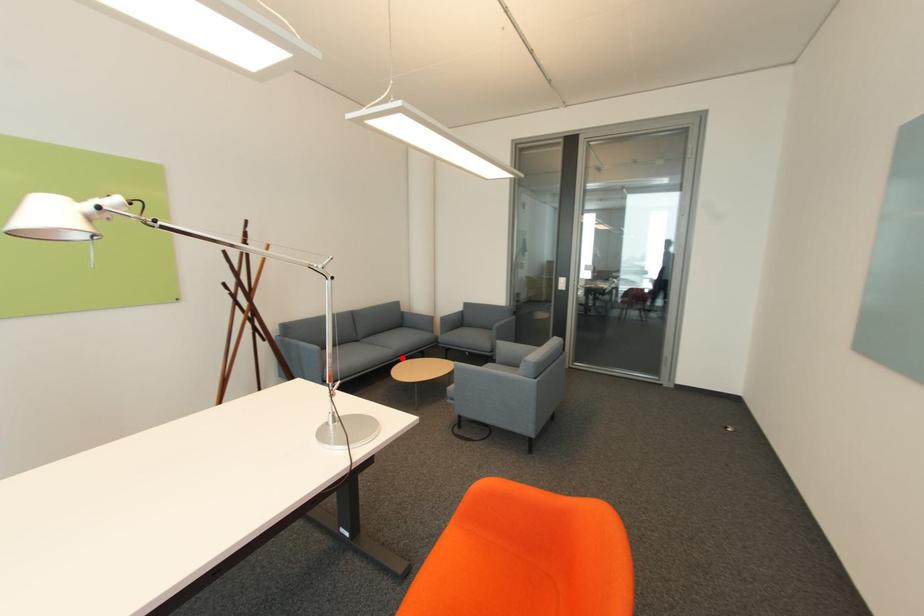
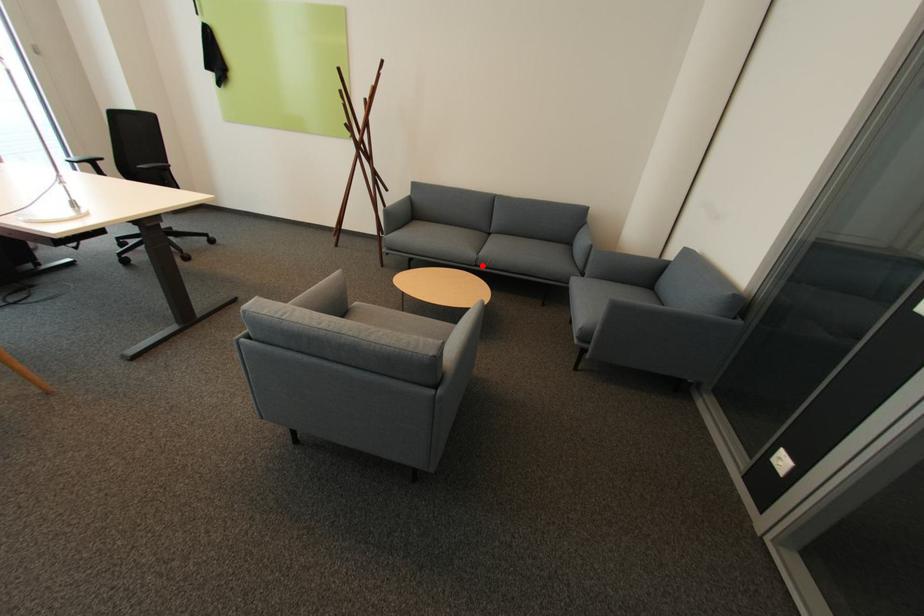
I am providing you with two images of the same scene from different viewpoints. A red point is marked on the first image and another point is marked on the second image. Does the point marked in image1 correspond to the same location as the one in image2?

Yes